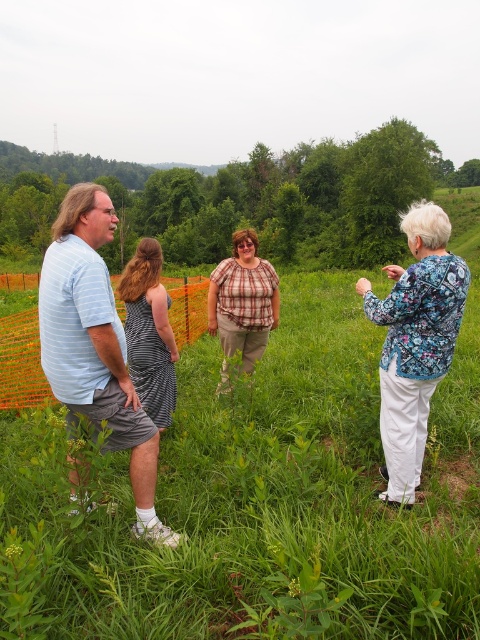
You are a photographer trying to capture a clear shot of the floral print blouse at right without the green grass at center blocking it. Based on their positions, can you adjust your camera angle to achieve this?

The green grass at center is in front of the floral print blouse at right, so adjusting the camera angle to focus behind the green grass at center might allow you to capture the floral print blouse at right without obstruction.

Based on the scene description, what is located at the coordinates point (257,500)?

The coordinates point (257,500) has green grass at center.